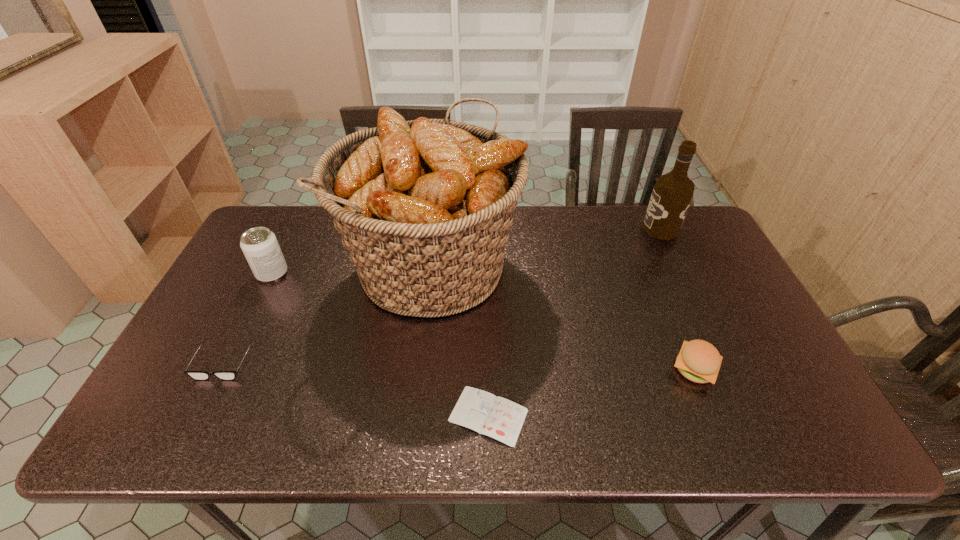
The image size is (960, 540). Identify the location of vacant area situated 0.230m on the front of the soda can. click(236, 347).

Where is `vacant point located on the back of the hamburger`? This screenshot has height=540, width=960. vacant point located on the back of the hamburger is located at coordinates (674, 319).

Identify the location of blank space located 0.070m on the front-facing side of the spectacles. (202, 408).

This screenshot has width=960, height=540. I want to click on vacant space positioned 0.140m on the right of the shortest object, so click(x=590, y=415).

The height and width of the screenshot is (540, 960). What are the coordinates of `basket that is at the far edge` in the screenshot? It's located at click(x=424, y=207).

Find the location of a particular element. The image size is (960, 540). alcohol located at the far edge is located at coordinates (672, 193).

Identify the location of object present at the near edge. The height and width of the screenshot is (540, 960). (499, 418).

This screenshot has height=540, width=960. Find the location of `soda can that is at the left edge`. soda can that is at the left edge is located at coordinates (260, 246).

The width and height of the screenshot is (960, 540). In order to click on spectacles present at the left edge in this screenshot , I will do `click(196, 375)`.

Where is `object that is at the right edge`? object that is at the right edge is located at coordinates (672, 193).